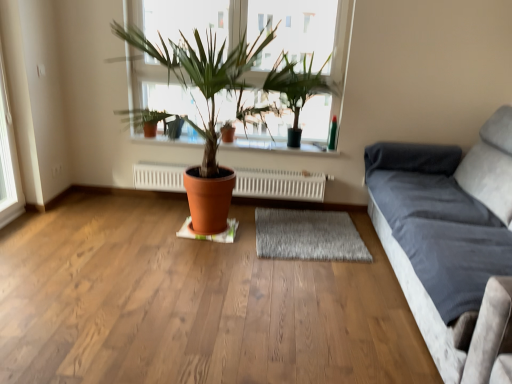
Find the location of a particular element. unoccupied region to the right of white plastic window frame at left is located at coordinates (42, 221).